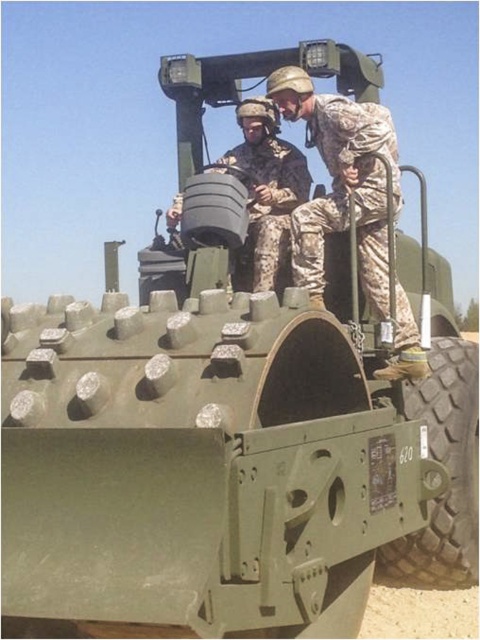
Can you confirm if camouflage fabric uniform at center is shorter than camouflage fabric helmet at upper center?

No.

Who is more forward, (310, 237) or (238, 170)?

Point (310, 237) is in front.

Where is `camouflage fabric uniform at center`? camouflage fabric uniform at center is located at coordinates (342, 180).

Is rubber tread tire at lower right to the right of camouflage fabric helmet at upper center from the viewer's perspective?

Correct, you'll find rubber tread tire at lower right to the right of camouflage fabric helmet at upper center.

Does rubber tread tire at lower right appear on the left side of camouflage fabric helmet at upper center?

In fact, rubber tread tire at lower right is to the right of camouflage fabric helmet at upper center.

The width and height of the screenshot is (480, 640). Describe the element at coordinates (447, 472) in the screenshot. I see `rubber tread tire at lower right` at that location.

Where is `rubber tread tire at lower right`? rubber tread tire at lower right is located at coordinates (x=447, y=472).

How much distance is there between camouflage fabric uniform at center and rubber tread tire at lower right?

camouflage fabric uniform at center is 34.28 inches from rubber tread tire at lower right.

In order to click on camouflage fabric uniform at center in this screenshot , I will do `click(342, 180)`.